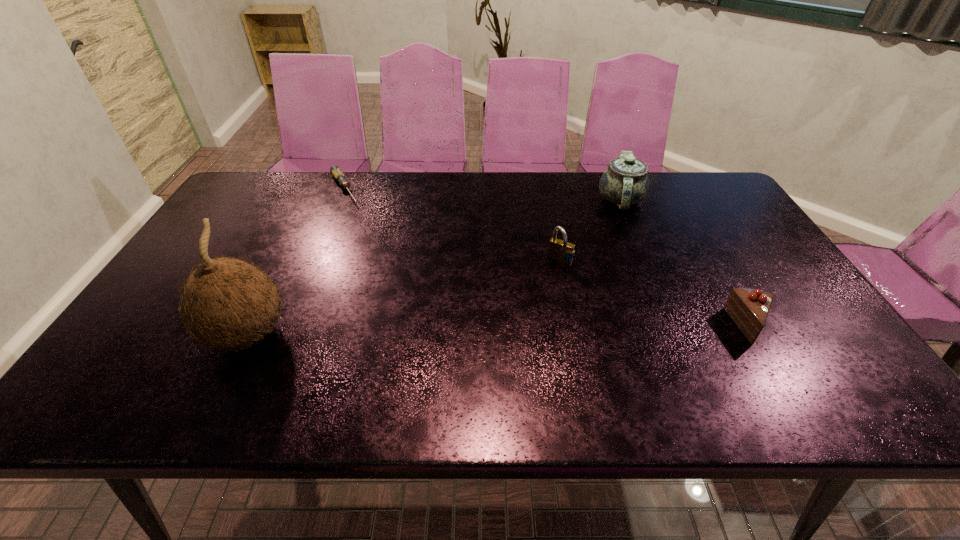
The width and height of the screenshot is (960, 540). Find the location of `free space located 0.250m insert the shortest object into a screw head`. free space located 0.250m insert the shortest object into a screw head is located at coordinates tap(375, 246).

Find the location of a particular element. The width and height of the screenshot is (960, 540). free location located 0.230m insert the shortest object into a screw head is located at coordinates (372, 242).

Find the location of a particular element. vacant space located 0.130m insert the shortest object into a screw head is located at coordinates (361, 225).

You are a GUI agent. You are given a task and a screenshot of the screen. Output one action in this format:
    pyautogui.click(x=<x>, y=<y>)
    Task: Click on the vacant space situated on the side with the combination dials of the third farthest object
    
    Given the screenshot: What is the action you would take?
    (x=537, y=298)

Locate an element on the screen. free space located on the side with the combination dials of the third farthest object is located at coordinates (501, 354).

I want to click on free location located 0.260m on the side with the combination dials of the third farthest object, so click(515, 333).

The width and height of the screenshot is (960, 540). What are the coordinates of `blank space located from the spout of the second object from right to left` in the screenshot? It's located at (600, 241).

This screenshot has height=540, width=960. What are the coordinates of `free spot located from the spout of the second object from right to left` in the screenshot? It's located at (565, 291).

Locate an element on the screen. vacant space located from the spout of the second object from right to left is located at coordinates (595, 248).

I want to click on screwdriver that is at the far edge, so click(335, 170).